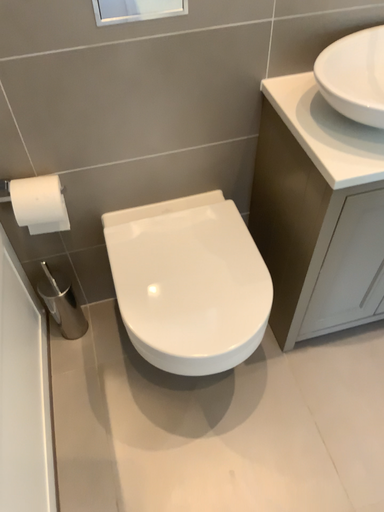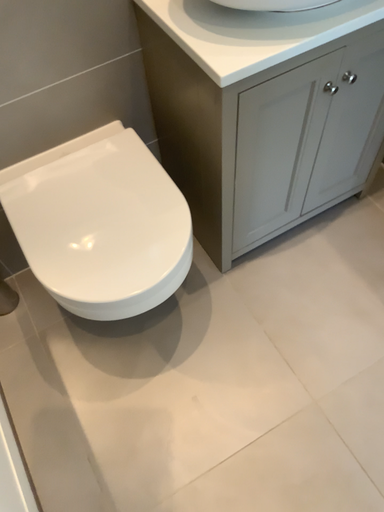
Question: Which way did the camera rotate in the video?

Choices:
 (A) rotated downward
 (B) rotated upward

Answer: (A)